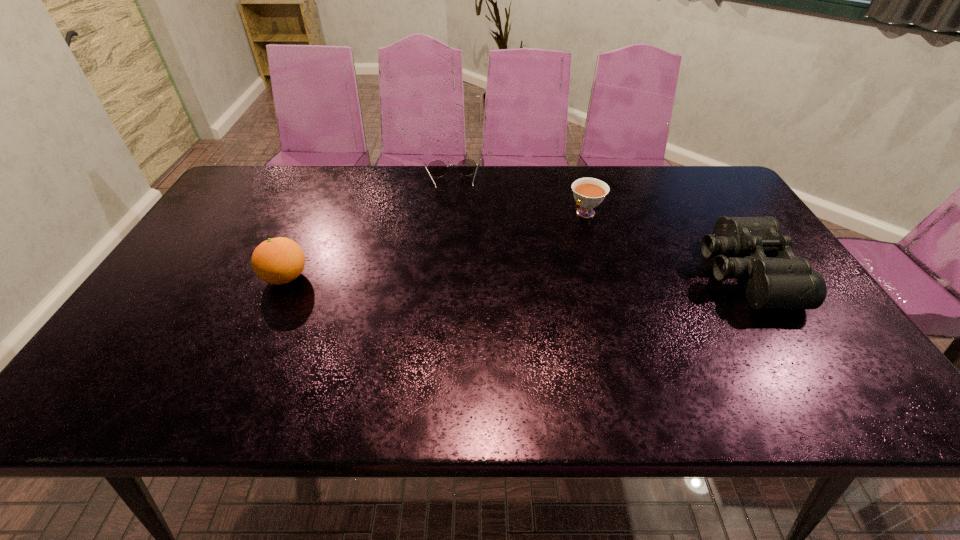
Find the location of `free spot on the desktop that is between the orange and the rightmost object and is positioned on the side of the second shortest object with the handle`. free spot on the desktop that is between the orange and the rightmost object and is positioned on the side of the second shortest object with the handle is located at coordinates (516, 275).

Find the location of a particular element. The height and width of the screenshot is (540, 960). free space on the desktop that is between the orange and the binoculars and is positioned on the front-facing side of the farthest object is located at coordinates (461, 276).